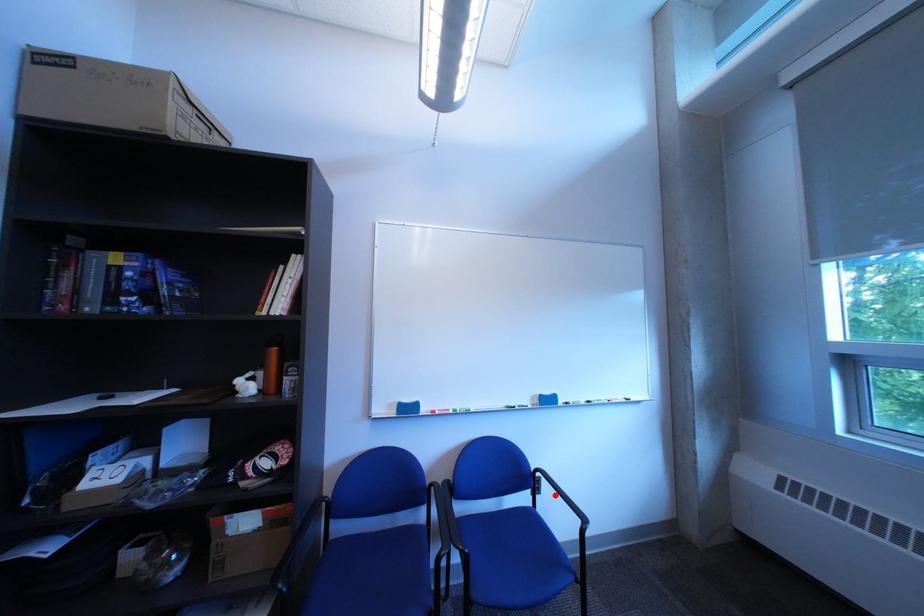
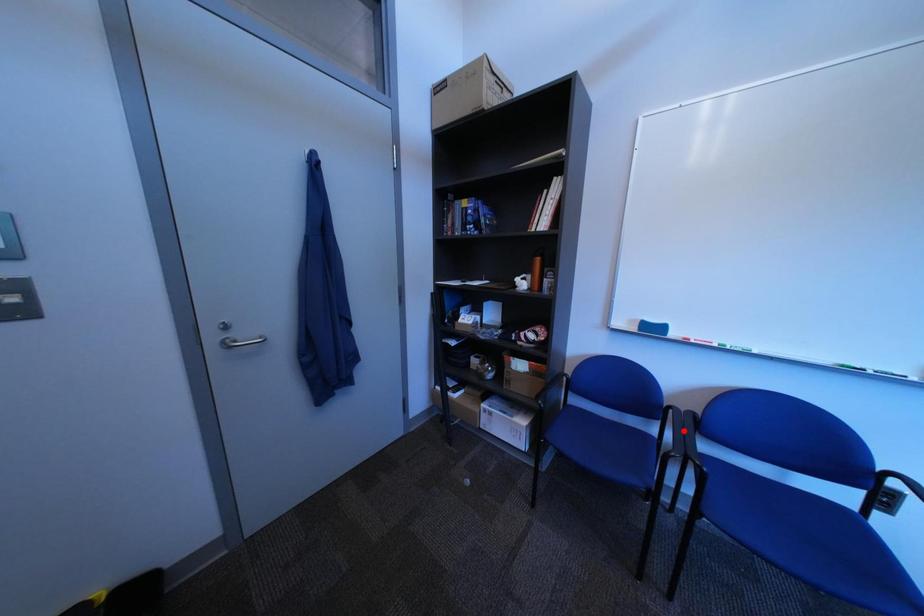
I am providing you with two images of the same scene from different viewpoints. A red point is marked on the first image and another point is marked on the second image. Is the red point in image1 aligned with the point shown in image2?

No